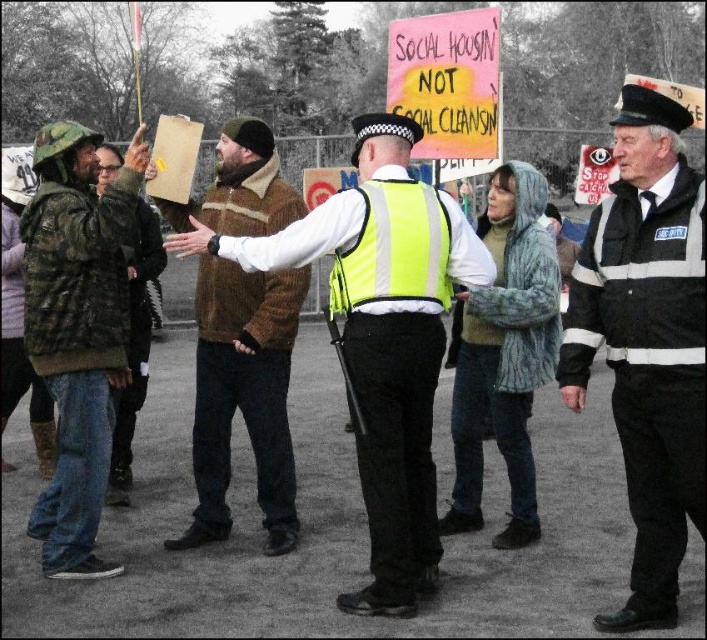
Can you confirm if camouflage fabric jacket at left is positioned below brown fuzzy jacket at center?

Yes.

At what (x,y) coordinates should I click in order to perform the action: click on camouflage fabric jacket at left. Please return your answer as a coordinate pair (x, y). The width and height of the screenshot is (707, 640). Looking at the image, I should click on (76, 330).

Does camouflage fabric jacket at left have a lesser width compared to camouflage jacket at left?

No.

Does point (119, 320) lie behind point (132, 336)?

No, (119, 320) is in front of (132, 336).

Between point (52, 509) and point (136, 323), which one is positioned behind?

The point (136, 323) is behind.

At what (x,y) coordinates should I click in order to perform the action: click on camouflage fabric jacket at left. Please return your answer as a coordinate pair (x, y). Looking at the image, I should click on (76, 330).

Can you confirm if black uniform at center is thinner than camouflage fabric jacket at left?

Yes.

Is point (633, 188) closer to viewer compared to point (54, 240)?

Yes, it is in front of point (54, 240).

Which is in front, point (631, 625) or point (69, 259)?

Point (631, 625)

Where is `black uniform at center`? This screenshot has width=707, height=640. black uniform at center is located at coordinates (645, 340).